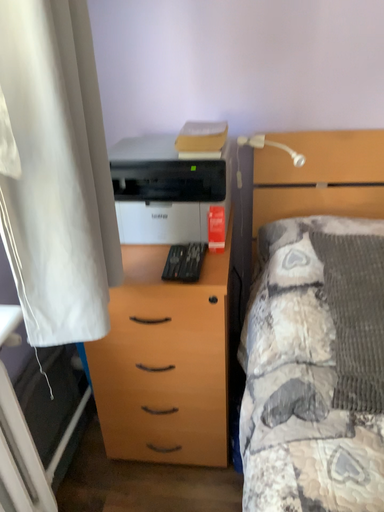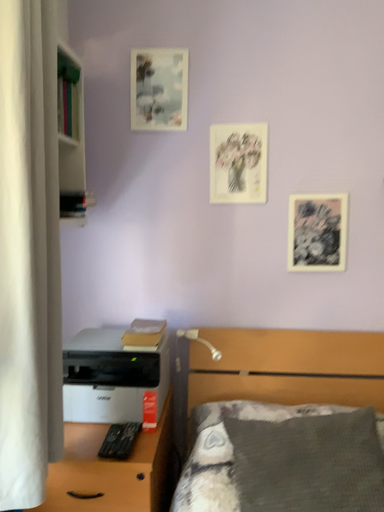
Question: Which way did the camera rotate in the video?

Choices:
 (A) rotated upward
 (B) rotated downward

Answer: (A)